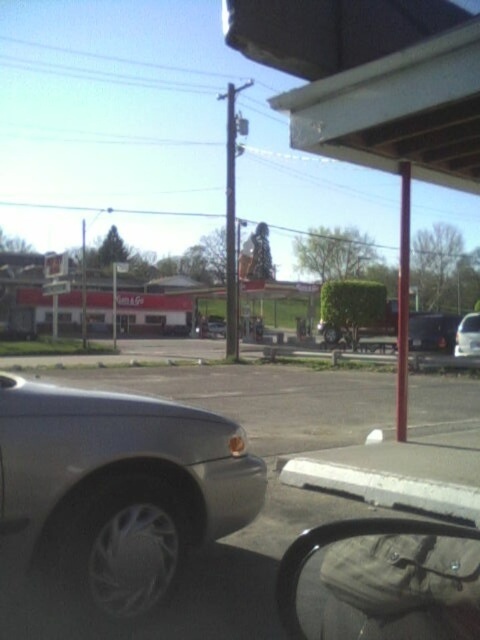
Can you confirm if gray asphalt parking lot at center is shorter than satin black sedan at center?

Yes.

Describe the element at coordinates (264, 458) in the screenshot. I see `gray asphalt parking lot at center` at that location.

Locate an element on the screen. gray asphalt parking lot at center is located at coordinates coord(264,458).

From the picture: Is silver metallic car at lower left closer to camera compared to satin black sedan at center?

Yes, it is.

Can you confirm if silver metallic car at lower left is wider than satin black sedan at center?

Incorrect, silver metallic car at lower left's width does not surpass satin black sedan at center's.

Identify the location of silver metallic car at lower left. This screenshot has height=640, width=480. (118, 490).

Where is `silver metallic car at lower left`? silver metallic car at lower left is located at coordinates click(x=118, y=490).

Looking at this image, can you confirm if silver metallic car at lower left is positioned below gray asphalt parking lot at center?

Incorrect, silver metallic car at lower left is not positioned below gray asphalt parking lot at center.

Is point (73, 582) positioned after point (458, 394)?

No, it is in front of (458, 394).

Identify the location of silver metallic car at lower left. (118, 490).